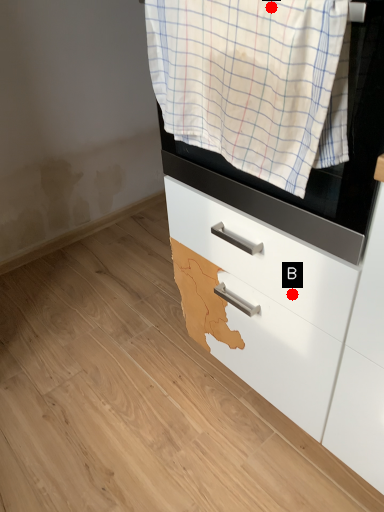
Question: Two points are circled on the image, labeled by A and B beside each circle. Which point is closer to the camera?

Choices:
 (A) A is closer
 (B) B is closer

Answer: (A)